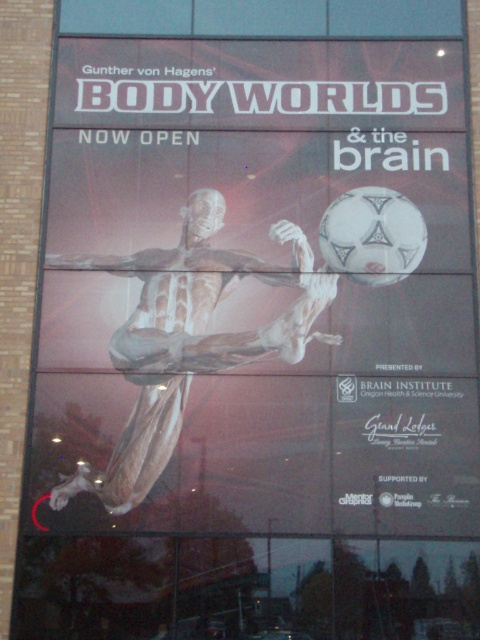
Question: Among these objects, which one is farthest from the camera?

Choices:
 (A) translucent flesh at center
 (B) transparent plastic figure at lower left

Answer: (A)

Question: Among these objects, which one is nearest to the camera?

Choices:
 (A) translucent flesh at center
 (B) transparent plastic figure at lower left

Answer: (B)

Question: In this image, where is transparent plastic figure at lower left located relative to translucent flesh at center?

Choices:
 (A) left
 (B) right

Answer: (B)

Question: Which of the following is the farthest from the observer?

Choices:
 (A) translucent flesh at center
 (B) transparent plastic figure at lower left

Answer: (A)

Question: Observing the image, what is the correct spatial positioning of transparent plastic figure at lower left in reference to translucent flesh at center?

Choices:
 (A) left
 (B) right

Answer: (B)

Question: Observing the image, what is the correct spatial positioning of transparent plastic figure at lower left in reference to translucent flesh at center?

Choices:
 (A) above
 (B) below

Answer: (A)